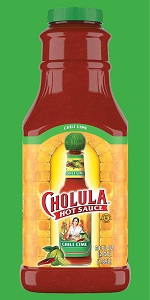
Locate an element on the screen. The height and width of the screenshot is (300, 150). bottle lid is located at coordinates (82, 14).